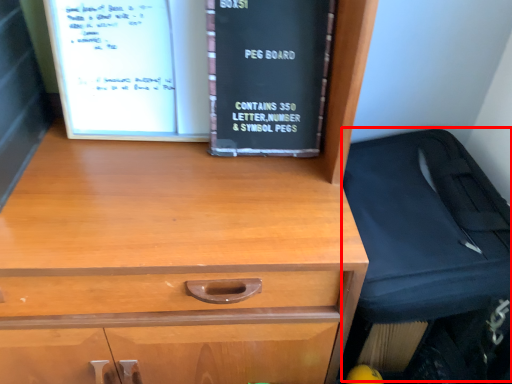
Question: From the image's perspective, where is luggage (annotated by the red box) located relative to book?

Choices:
 (A) above
 (B) below

Answer: (B)